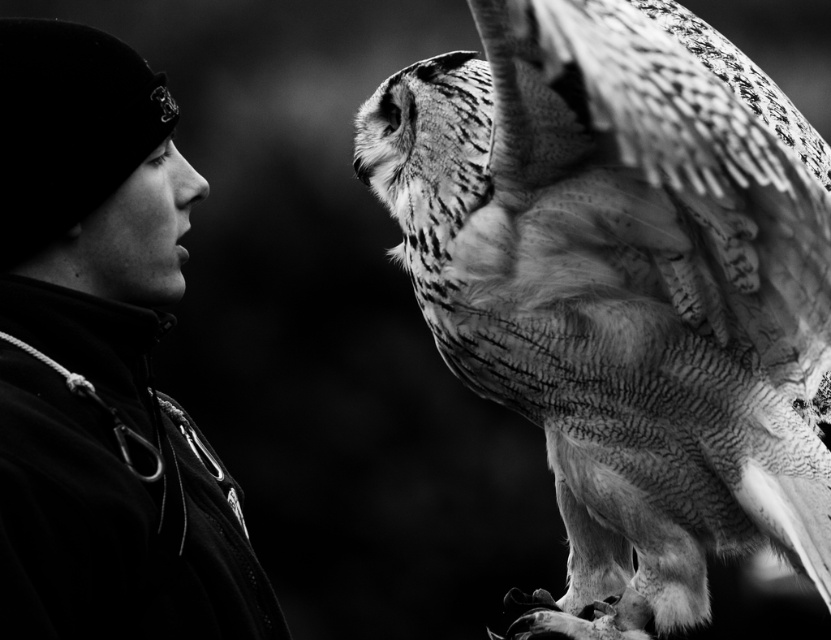
You are looking at the black and white photograph of a person and an owl. There are two points marked in the image. The first point is at coordinate point (628, 536) and the second point is at coordinate point (11, 493). Which of these two points is closer to you?

Point (11, 493) is closer to you because it is less further to the camera than point (628, 536).

Consider the image. You are a photographer trying to capture a closeup of the speckled feathered owl at right and the dark fabric jacket at left in the same frame. Based on their sizes, which object should you focus on first to ensure both are in the frame?

The speckled feathered owl at right is larger than the dark fabric jacket at left, so you should focus on the speckled feathered owl at right first to ensure both fit within the frame.